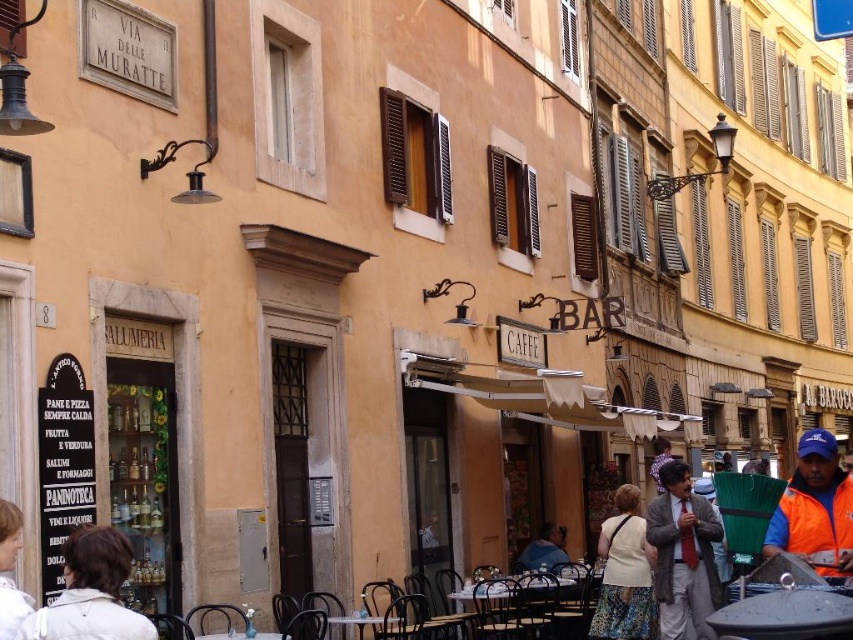
Question: Which point is farther from the camera taking this photo?

Choices:
 (A) (4, 608)
 (B) (624, 604)

Answer: (B)

Question: Is orange reflective jacket at lower right below translucent glass table at center?

Choices:
 (A) no
 (B) yes

Answer: (A)

Question: Which of the following is the farthest from the observer?

Choices:
 (A) (645, 621)
 (B) (720, 529)

Answer: (A)

Question: Which object is positioned farthest from the white fabric jacket at lower left?

Choices:
 (A) orange reflective jacket at lower right
 (B) blue denim jacket at lower center
 (C) translucent glass table at center

Answer: (B)

Question: Is blue denim jacket at lower center positioned in front of white glossy table at lower center?

Choices:
 (A) yes
 (B) no

Answer: (B)

Question: Can you confirm if orange reflective jacket at lower right is thinner than blue denim jacket at lower center?

Choices:
 (A) no
 (B) yes

Answer: (A)